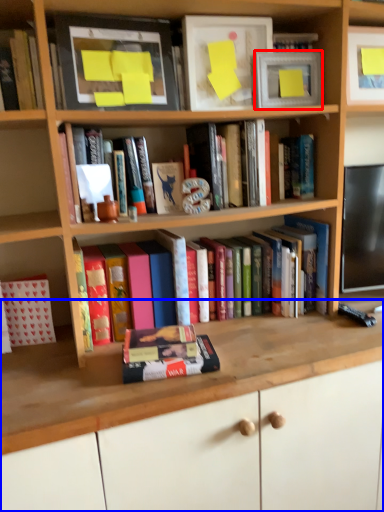
Question: Among these objects, which one is nearest to the camera, picture frame (highlighted by a red box) or computer desk (highlighted by a blue box)?

Choices:
 (A) picture frame
 (B) computer desk

Answer: (B)